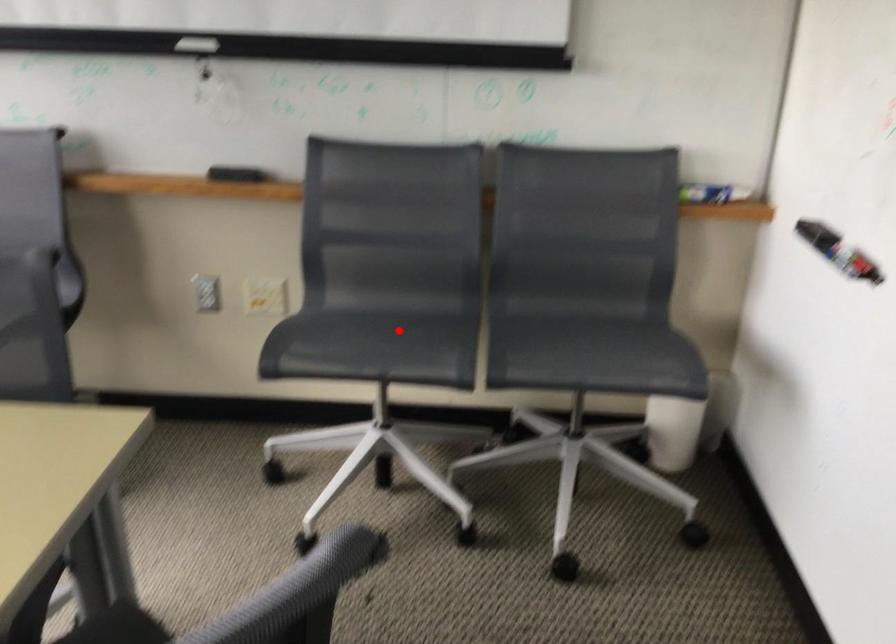
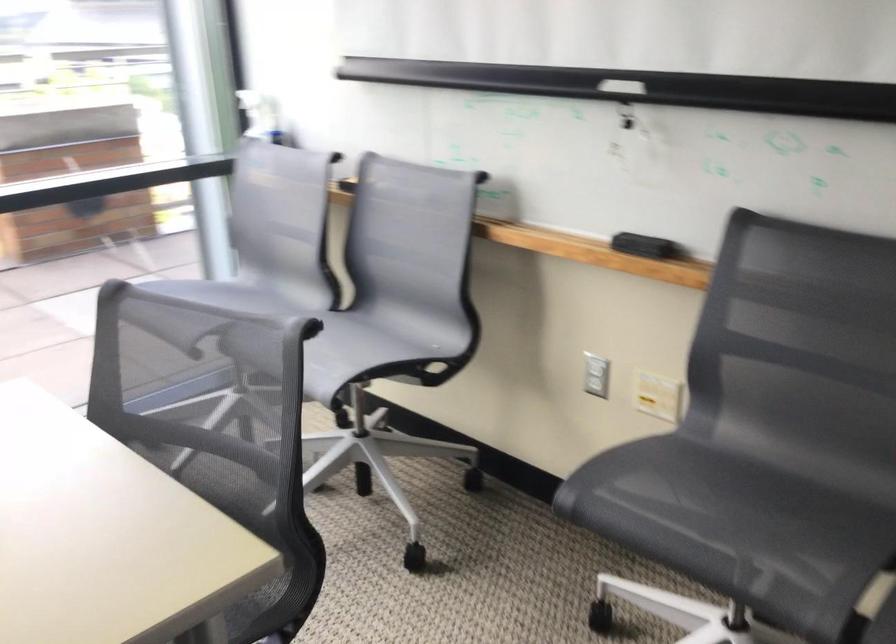
Question: A red point is marked in image1. In image2, is the corresponding 3D point closer to the camera or farther? Reply with the corresponding letter.

Choices:
 (A) The corresponding 3D point is closer.
 (B) The corresponding 3D point is farther.

Answer: (A)